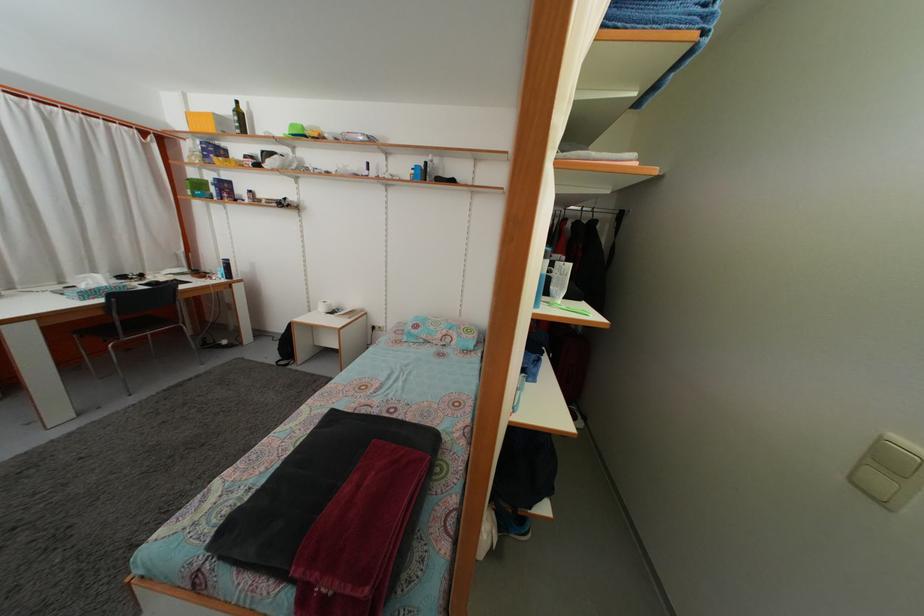
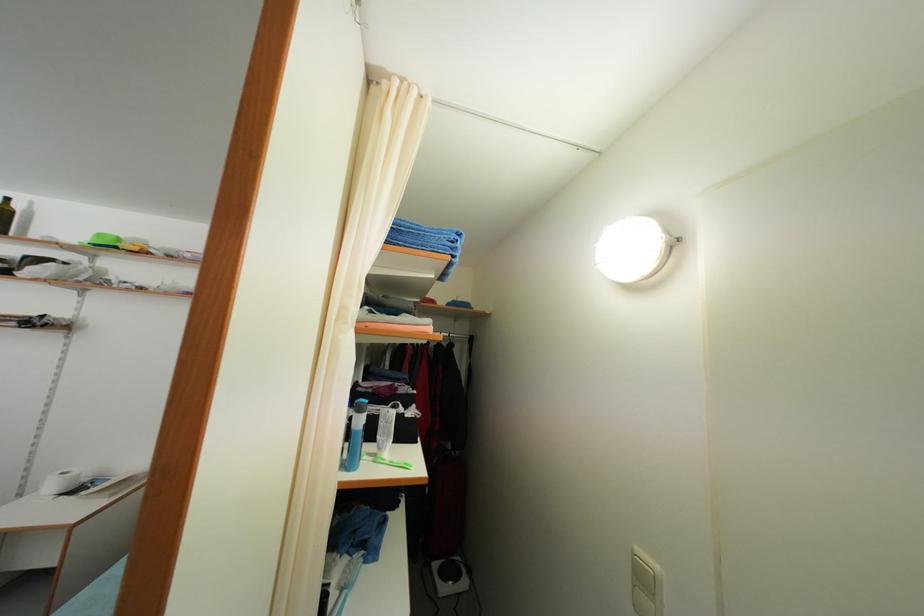
The point at (x=869, y=471) is marked in the first image. Where is the corresponding point in the second image?

(639, 593)